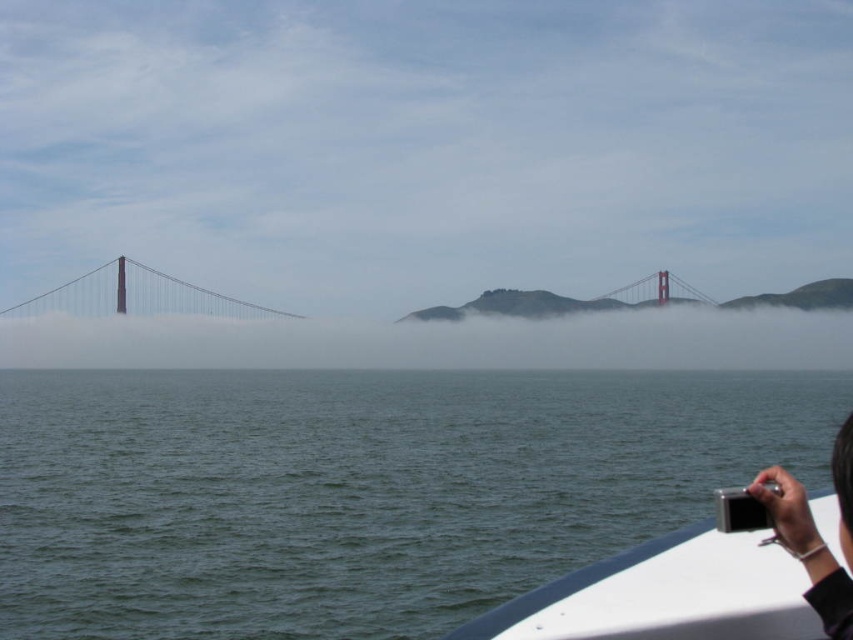
From the picture: Is metallic suspension bridge at left thinner than metallic bridge at center?

No.

Is metallic suspension bridge at left further to the viewer compared to metallic bridge at center?

That is False.

Who is more forward, (122,282) or (653,284)?

Point (122,282) is in front.

Where is `metallic suspension bridge at left`? metallic suspension bridge at left is located at coordinates (136, 296).

Who is higher up, white plastic boat at lower right or black matte camera at lower right?

black matte camera at lower right

Consider the image. Is white plastic boat at lower right bigger than black matte camera at lower right?

Actually, white plastic boat at lower right might be smaller than black matte camera at lower right.

Is point (577, 579) positioned in front of point (807, 528)?

No, (577, 579) is behind (807, 528).

Identify the location of white plastic boat at lower right. (709, 577).

Which is more to the left, black matte camera at lower right or metallic bridge at center?

black matte camera at lower right is more to the left.

Who is shorter, black matte camera at lower right or metallic bridge at center?

With less height is black matte camera at lower right.

What do you see at coordinates (807, 548) in the screenshot? This screenshot has height=640, width=853. I see `black matte camera at lower right` at bounding box center [807, 548].

You are a GUI agent. You are given a task and a screenshot of the screen. Output one action in this format:
    pyautogui.click(x=<x>, y=<y>)
    Task: Click on the black matte camera at lower right
    This screenshot has width=853, height=640.
    Given the screenshot: What is the action you would take?
    pyautogui.click(x=807, y=548)